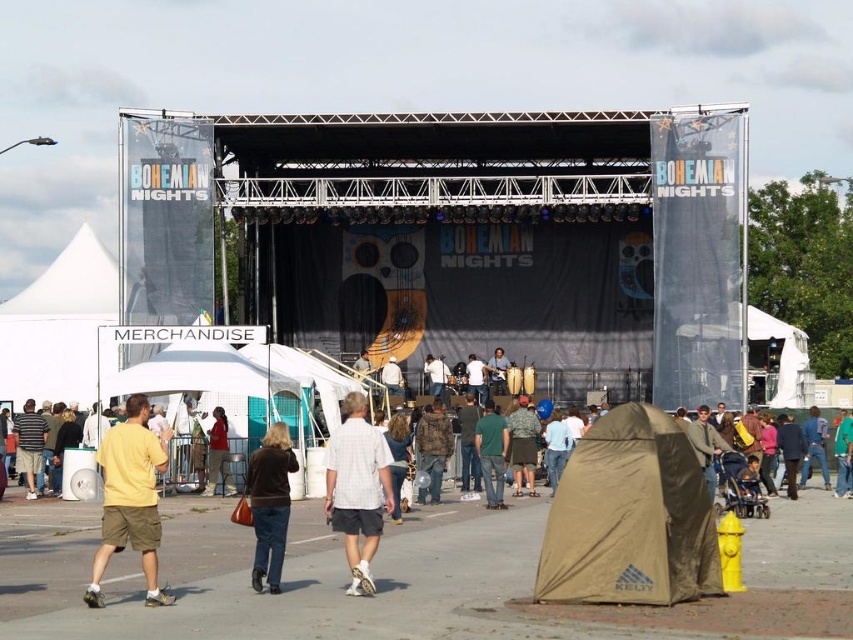
Question: From the image, what is the correct spatial relationship of brown leather jacket at center in relation to khaki cotton jacket at center?

Choices:
 (A) above
 (B) below

Answer: (B)

Question: Is blue denim jeans at lower right positioned in front of matte brown jacket at center?

Choices:
 (A) no
 (B) yes

Answer: (A)

Question: Which point is closer to the camera?

Choices:
 (A) (520, 429)
 (B) (444, 428)
 (C) (833, 444)

Answer: (B)

Question: Is camouflage jacket at center positioned in front of matte brown jacket at center?

Choices:
 (A) no
 (B) yes

Answer: (B)

Question: Among these objects, which one is nearest to the camera?

Choices:
 (A) tan canvas tent at lower right
 (B) khaki cotton jacket at center
 (C) white shirt at center

Answer: (A)

Question: Which object is the farthest from the khaki cotton jacket at center?

Choices:
 (A) green cotton shirt at center
 (B) yellow cotton shirt at lower left

Answer: (B)